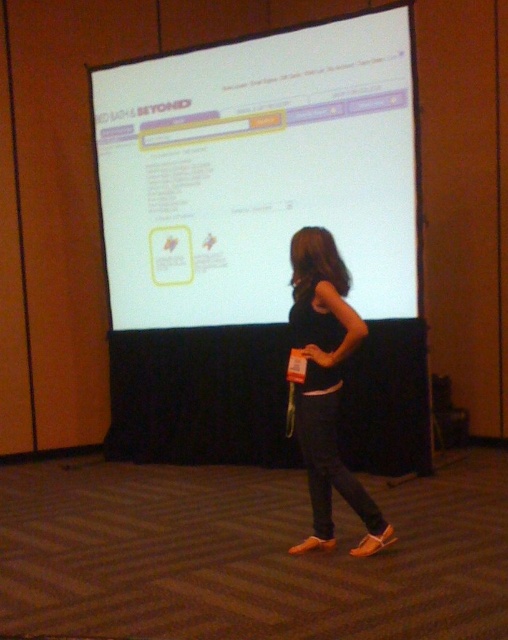
Which of these two, white glossy projection screen at upper center or black fabric dress at center, stands taller?

white glossy projection screen at upper center is taller.

Does white glossy projection screen at upper center have a greater width compared to black fabric dress at center?

Correct, the width of white glossy projection screen at upper center exceeds that of black fabric dress at center.

Which is in front, point (362, 276) or point (331, 380)?

Positioned in front is point (331, 380).

This screenshot has width=508, height=640. What are the coordinates of `white glossy projection screen at upper center` in the screenshot? It's located at (258, 172).